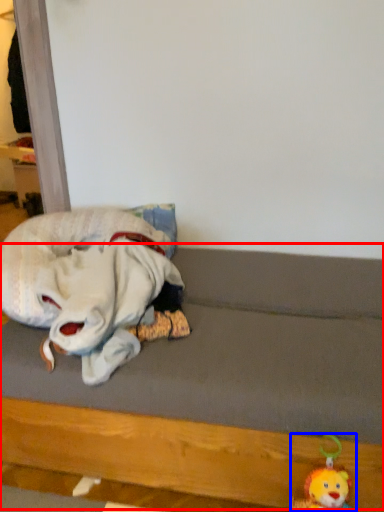
Question: Which object is further to the camera taking this photo, bed frame (highlighted by a red box) or toy (highlighted by a blue box)?

Choices:
 (A) bed frame
 (B) toy

Answer: (B)